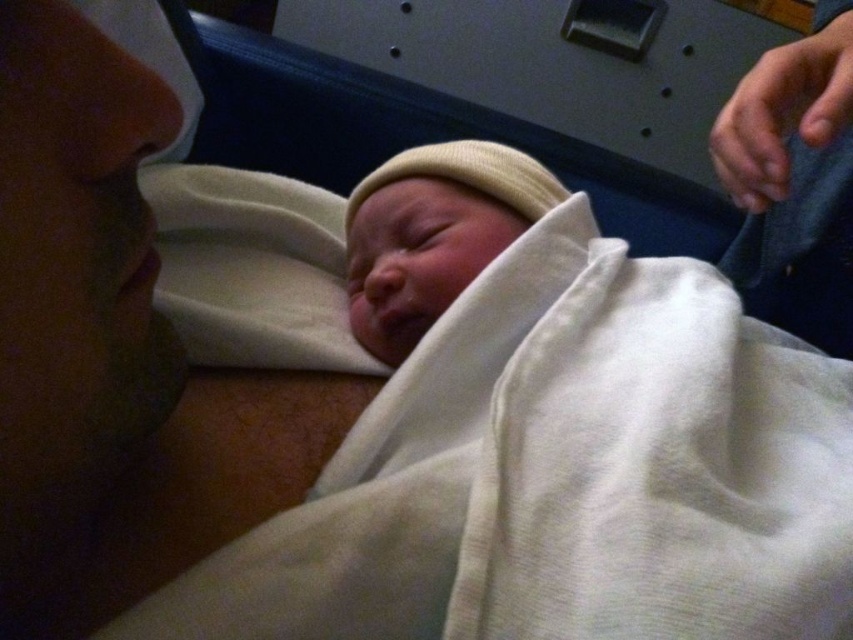
Is the position of smooth skin face at left less distant than that of white knit cap at center?

That is True.

Can you confirm if smooth skin face at left is wider than white knit cap at center?

Incorrect, smooth skin face at left's width does not surpass white knit cap at center's.

Is point (49, 180) positioned behind point (444, 172)?

No, it is not.

You are a GUI agent. You are given a task and a screenshot of the screen. Output one action in this format:
    pyautogui.click(x=<x>, y=<y>)
    Task: Click on the smooth skin face at left
    Image resolution: width=853 pixels, height=640 pixels.
    Given the screenshot: What is the action you would take?
    [x=115, y=353]